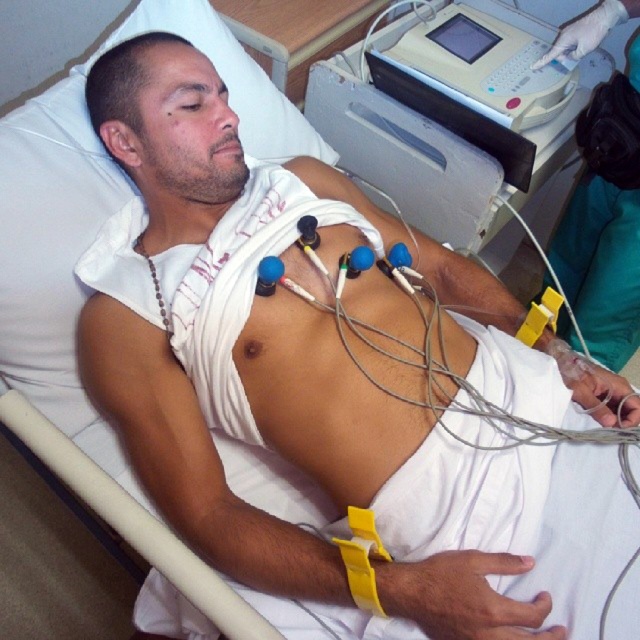
Question: Which object appears farthest from the camera in this image?

Choices:
 (A) white plastic machine at upper right
 (B) gray plastic machine at upper right

Answer: (A)

Question: Can you confirm if gray plastic machine at upper right is thinner than white plastic machine at upper right?

Choices:
 (A) no
 (B) yes

Answer: (A)

Question: Observing the image, what is the correct spatial positioning of gray plastic machine at upper right in reference to white plastic machine at upper right?

Choices:
 (A) left
 (B) right

Answer: (A)

Question: Is gray plastic machine at upper right positioned at the back of white plastic machine at upper right?

Choices:
 (A) no
 (B) yes

Answer: (A)

Question: Which point is farther to the camera?

Choices:
 (A) gray plastic machine at upper right
 (B) white plastic machine at upper right

Answer: (B)